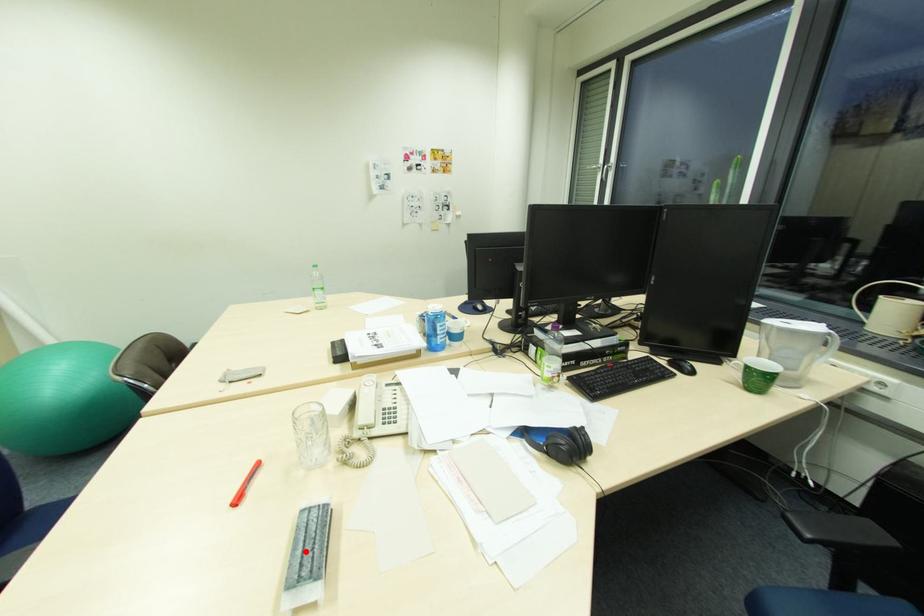
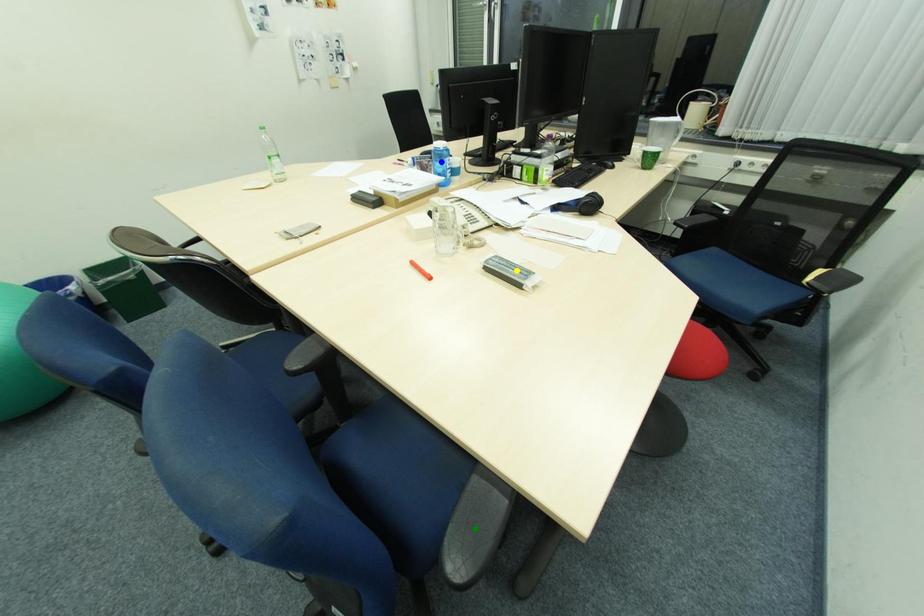
Question: I am providing you with two images of the same scene from different viewpoints. A red point is marked on the first image. You are given multiple points on the second image. Which point in image 2 is actually the same real-world point as the red point in image 1?

Choices:
 (A) yellow point
 (B) green point
 (C) blue point

Answer: (A)